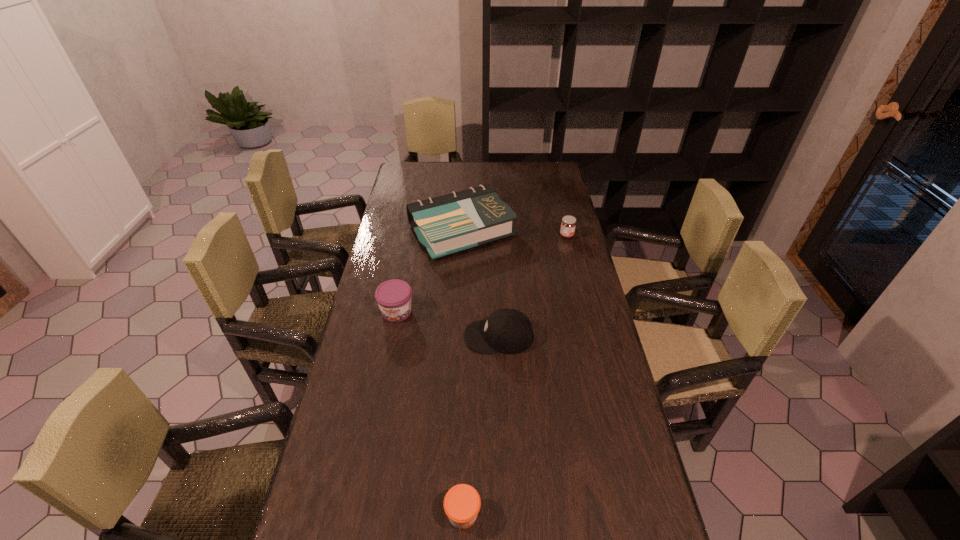
Where is `paperback book`? The width and height of the screenshot is (960, 540). paperback book is located at coordinates (450, 223).

Locate an element on the screen. Image resolution: width=960 pixels, height=540 pixels. cap is located at coordinates (509, 331).

This screenshot has height=540, width=960. In order to click on the tallest jam in this screenshot , I will do `click(394, 296)`.

Where is `the second farthest jam`? Image resolution: width=960 pixels, height=540 pixels. the second farthest jam is located at coordinates (394, 296).

Image resolution: width=960 pixels, height=540 pixels. Identify the location of the rightmost object. (568, 223).

Identify the location of the second shortest jam. This screenshot has width=960, height=540. (568, 223).

In order to click on the shortest jam in this screenshot , I will do `click(462, 503)`.

Identify the location of the nearest object. (462, 503).

Identify the location of free spot located 0.390m on the back of the paperback book. Image resolution: width=960 pixels, height=540 pixels. (465, 161).

The height and width of the screenshot is (540, 960). Identify the location of vacant point located 0.190m on the front-facing side of the cap. (404, 336).